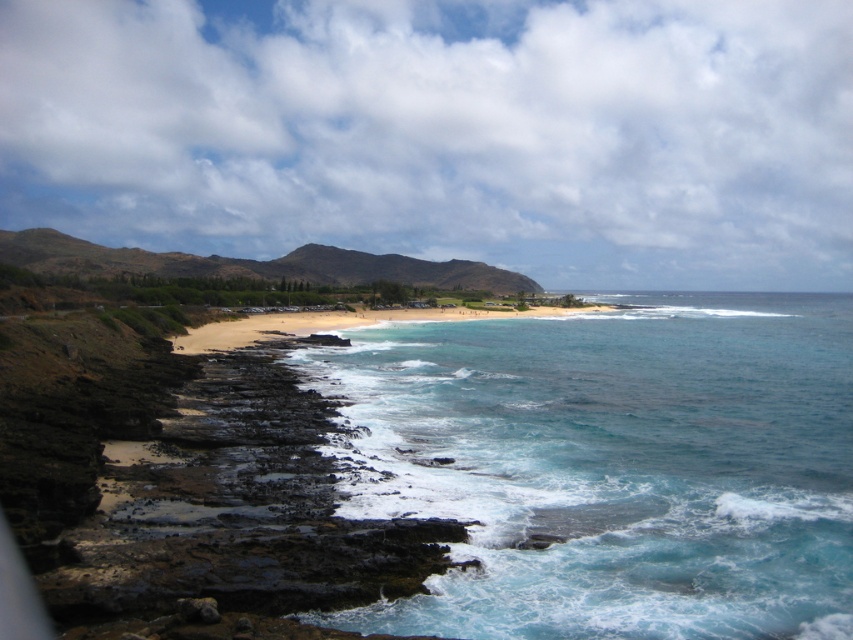
You are standing on the golden sand beach at center and want to walk to the dark brown rocky cliffs at lower left. Which direction should you move to reach them?

The dark brown rocky cliffs at lower left are in front of the golden sand beach at center, so you should move forward towards the dark brown rocky cliffs at lower left to reach them.

You are a kayaker planning to navigate through the coastal area shown. You see the clear blue water at center and the dark brown rocky cliffs at lower left. Which direction should you aim for to avoid hitting the rocks?

You should aim towards the clear blue water at center, as it is positioned over the dark brown rocky cliffs at lower left, indicating it is a safer, open water area away from the rocky terrain.